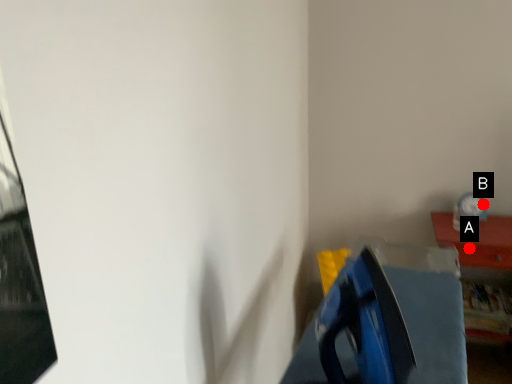
Question: Two points are circled on the image, labeled by A and B beside each circle. Which point is closer to the camera?

Choices:
 (A) A is closer
 (B) B is closer

Answer: (A)